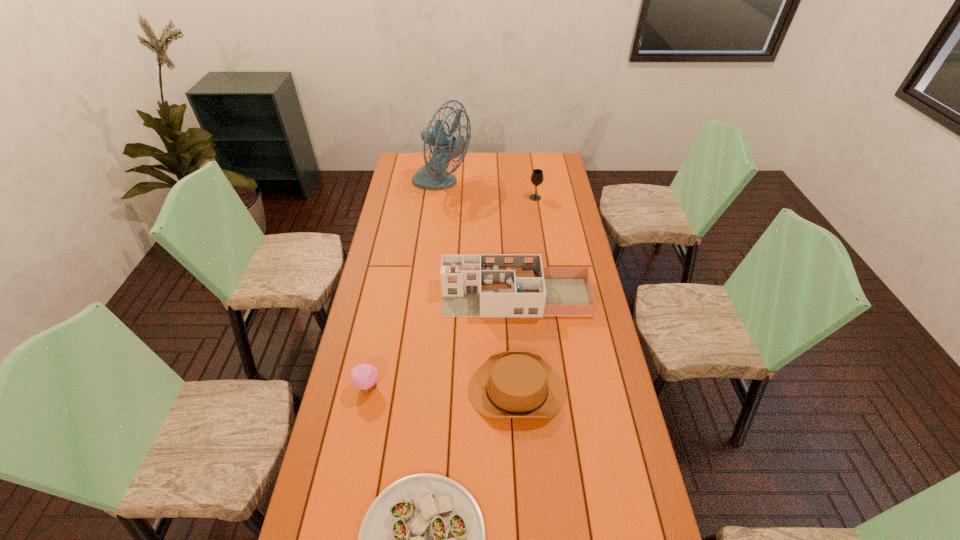
Locate an element on the screen. This screenshot has width=960, height=540. fan is located at coordinates (432, 176).

Locate an element on the screen. The image size is (960, 540). wineglass is located at coordinates (537, 177).

Where is `dollhouse`? Image resolution: width=960 pixels, height=540 pixels. dollhouse is located at coordinates (473, 285).

The image size is (960, 540). Find the location of `cupcake`. cupcake is located at coordinates (364, 377).

Locate an element on the screen. This screenshot has width=960, height=540. cowboy hat is located at coordinates (511, 384).

You are a GUI agent. You are given a task and a screenshot of the screen. Output one action in this format:
    pyautogui.click(x=<x>, y=<y>)
    Task: Click on the free spot located 0.300m in front of the fan to blow air
    This screenshot has width=960, height=540.
    Given the screenshot: What is the action you would take?
    [529, 185]

This screenshot has height=540, width=960. Identify the location of free space located on the left of the wineglass. pos(519,198).

You are a GUI agent. You are given a task and a screenshot of the screen. Output one action in this format:
    pyautogui.click(x=<x>, y=<y>)
    Task: Click on the free space located 0.070m at the entrance of the fourth nearest object
    The width and height of the screenshot is (960, 540).
    Given the screenshot: What is the action you would take?
    pyautogui.click(x=424, y=297)

Find the location of a particular element. Image resolution: width=960 pixels, height=540 pixels. vacant space located 0.270m at the entrance of the fourth nearest object is located at coordinates (373, 297).

Where is `vacant space located at the entrance of the fourth nearest object`? This screenshot has width=960, height=540. vacant space located at the entrance of the fourth nearest object is located at coordinates (379, 297).